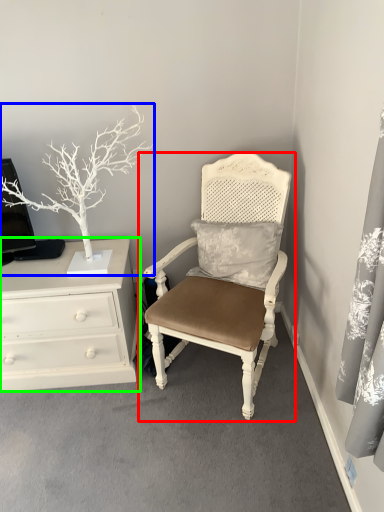
Question: Considering the real-world distances, which object is closest to chair (highlighted by a red box)? houseplant (highlighted by a blue box) or chest of drawers (highlighted by a green box).

Choices:
 (A) houseplant
 (B) chest of drawers

Answer: (B)